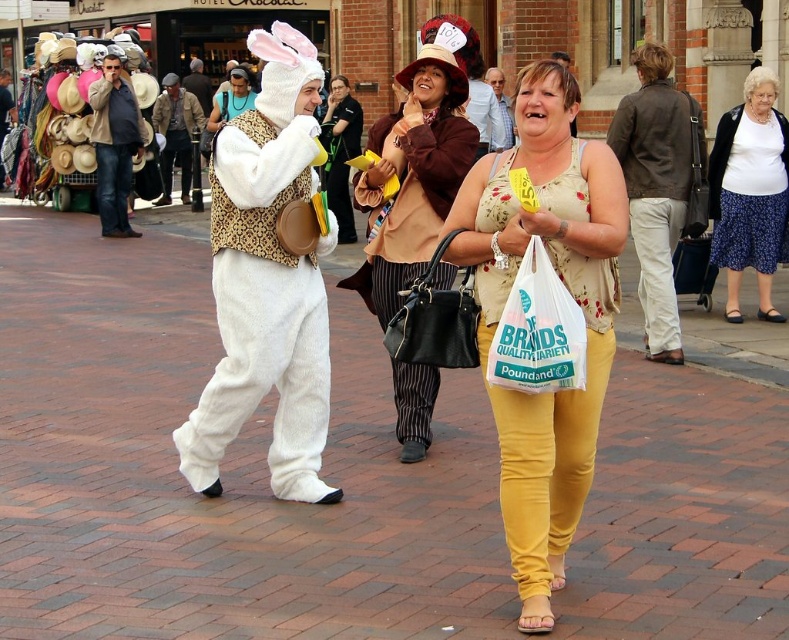
You are a photographer standing in the street scene. You want to take a photo that includes both the brick pavement at center and the brown leather jacket at upper right. Which object should you focus on first to ensure both are in the frame?

Since the brick pavement at center is closer to the viewer than the brown leather jacket at upper right, you should focus on the brick pavement at center first to ensure both are in the frame.

You are standing in the street scene and want to determine which of the two points, point [496,230] or point [111,157], is closer to you. Based on the scene description, which point is nearer?

Point [496,230] is closer to the viewer than point [111,157].